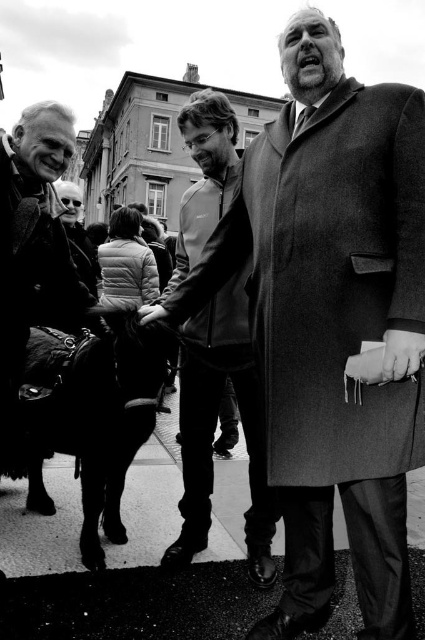
You are a photographer trying to capture a candid shot of the two subjects in the image. The smooth wool coat at center and the smooth leather hand at center are important elements. Given their distance apart, will you need to adjust your camera settings to ensure both are in focus simultaneously?

The smooth wool coat at center and the smooth leather hand at center are 13.97 meters apart. To ensure both are in focus, you would need to adjust your camera settings to a smaller aperture for a deeper depth of field.

Based on the scene description, where is the smooth wool coat at center located in the image?

The smooth wool coat at center is located at point (x=337, y=280) in the image.